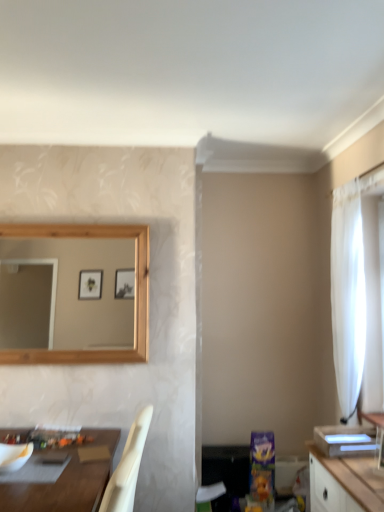
What do you see at coordinates (14, 456) in the screenshot?
I see `white matte mixing bowl at lower left` at bounding box center [14, 456].

Where is `brown wooden table at lower left`? This screenshot has height=512, width=384. brown wooden table at lower left is located at coordinates [x=67, y=482].

At what (x,y) coordinates should I click in order to perform the action: click on white sheer curtain at right. Please return your answer as a coordinate pair (x, y). Looking at the image, I should click on (349, 288).

From the picture: Could you tell me if white matte mixing bowl at lower left is turned towards white sheer curtain at right?

No, white matte mixing bowl at lower left does not turn towards white sheer curtain at right.

How far apart are white matte mixing bowl at lower left and white sheer curtain at right?

2.07 meters.

Consider the image. Are white matte mixing bowl at lower left and white sheer curtain at right located far from each other?

Absolutely, white matte mixing bowl at lower left is distant from white sheer curtain at right.

Where is `table located below the white sheer curtain at right (from the image's perspective)`? table located below the white sheer curtain at right (from the image's perspective) is located at coordinates pos(67,482).

Is white sheer curtain at right turned away from brown wooden table at lower left?

No, white sheer curtain at right is not facing away from brown wooden table at lower left.

Does white sheer curtain at right come in front of brown wooden table at lower left?

No, it is not.

Is brown wooden table at lower left surrounded by white sheer curtain at right?

No.

Who is smaller, white matte mixing bowl at lower left or brown wooden table at lower left?

Smaller between the two is white matte mixing bowl at lower left.

Is white matte mixing bowl at lower left positioned beyond the bounds of brown wooden table at lower left?

Yes.

From a real-world perspective, is white matte mixing bowl at lower left located higher than brown wooden table at lower left?

Indeed, from a real-world perspective, white matte mixing bowl at lower left stands above brown wooden table at lower left.

Who is more distant, white glossy vanity at right or white sheer curtain at right?

white sheer curtain at right.

Which point is more distant from viewer, (376,426) or (361,320)?

The point (376,426) is farther.

Can you confirm if white glossy vanity at right is bigger than white sheer curtain at right?

No.

From the image's perspective, is white glossy vanity at right located above white sheer curtain at right?

No.

From a real-world perspective, which is physically below, white sheer curtain at right or white matte mixing bowl at lower left?

From a 3D spatial view, white matte mixing bowl at lower left is below.

Do you think white sheer curtain at right is within white matte mixing bowl at lower left, or outside of it?

white sheer curtain at right is not enclosed by white matte mixing bowl at lower left.

Between white sheer curtain at right and white matte mixing bowl at lower left, which one has smaller size?

With smaller size is white matte mixing bowl at lower left.

How much distance is there between white sheer curtain at right and white matte mixing bowl at lower left?

A distance of 2.07 meters exists between white sheer curtain at right and white matte mixing bowl at lower left.

Does point (84, 496) come closer to viewer compared to point (339, 270)?

Yes.

From a real-world perspective, is brown wooden table at lower left physically above white sheer curtain at right?

No.

At what (x,y) coordinates should I click in order to perform the action: click on table below the white sheer curtain at right (from a real-world perspective). Please return your answer as a coordinate pair (x, y). Looking at the image, I should click on (67, 482).

Between brown wooden table at lower left and white sheer curtain at right, which one appears on the left side from the viewer's perspective?

From the viewer's perspective, brown wooden table at lower left appears more on the left side.

Is brown wooden table at lower left inside or outside of white glossy vanity at right?

brown wooden table at lower left is not inside white glossy vanity at right, it's outside.

How distant is brown wooden table at lower left from white glossy vanity at right?

A distance of 5.50 feet exists between brown wooden table at lower left and white glossy vanity at right.

In the scene shown: Is brown wooden table at lower left looking in the opposite direction of white glossy vanity at right?

No, white glossy vanity at right is not at the back of brown wooden table at lower left.

The image size is (384, 512). In order to click on mixing bowl beneath the white sheer curtain at right (from a real-world perspective) in this screenshot , I will do `click(14, 456)`.

You are a GUI agent. You are given a task and a screenshot of the screen. Output one action in this format:
    pyautogui.click(x=<x>, y=<y>)
    Task: Click on the table below the white sheer curtain at right (from the image's perspective)
    The height and width of the screenshot is (512, 384).
    Given the screenshot: What is the action you would take?
    pyautogui.click(x=67, y=482)

Looking at the image, which one is located closer to white matte mixing bowl at lower left, white sheer curtain at right or brown wooden table at lower left?

brown wooden table at lower left lies closer to white matte mixing bowl at lower left than the other object.

Which object lies nearer to the anchor point white matte mixing bowl at lower left, white glossy vanity at right or white sheer curtain at right?

Based on the image, white glossy vanity at right appears to be nearer to white matte mixing bowl at lower left.

Looking at the image, which one is located further to white matte mixing bowl at lower left, brown wooden table at lower left or white sheer curtain at right?

white sheer curtain at right is further to white matte mixing bowl at lower left.

From the picture: Looking at the image, which one is located further to white sheer curtain at right, white glossy vanity at right or white matte mixing bowl at lower left?

white matte mixing bowl at lower left lies further to white sheer curtain at right than the other object.

Looking at the image, which one is located further to white sheer curtain at right, white glossy vanity at right or brown wooden table at lower left?

brown wooden table at lower left is positioned further to the anchor white sheer curtain at right.

Based on their spatial positions, is white glossy vanity at right or brown wooden table at lower left closer to white matte mixing bowl at lower left?

brown wooden table at lower left lies closer to white matte mixing bowl at lower left than the other object.

Considering their positions, is brown wooden table at lower left positioned further to white sheer curtain at right than white glossy vanity at right?

brown wooden table at lower left is positioned further to the anchor white sheer curtain at right.

Looking at the image, which one is located closer to brown wooden table at lower left, white matte mixing bowl at lower left or white sheer curtain at right?

The object closer to brown wooden table at lower left is white matte mixing bowl at lower left.

This screenshot has height=512, width=384. In order to click on table located between white matte mixing bowl at lower left and white sheer curtain at right in the left-right direction in this screenshot , I will do (67, 482).

I want to click on vanity between white matte mixing bowl at lower left and white sheer curtain at right, so click(377, 434).

Find the location of a particular element. This screenshot has width=384, height=512. vanity located between brown wooden table at lower left and white sheer curtain at right in the left-right direction is located at coordinates (377, 434).

You are a GUI agent. You are given a task and a screenshot of the screen. Output one action in this format:
    pyautogui.click(x=<x>, y=<y>)
    Task: Click on the table between white matte mixing bowl at lower left and white glossy vanity at right from left to right
    This screenshot has width=384, height=512.
    Given the screenshot: What is the action you would take?
    pyautogui.click(x=67, y=482)